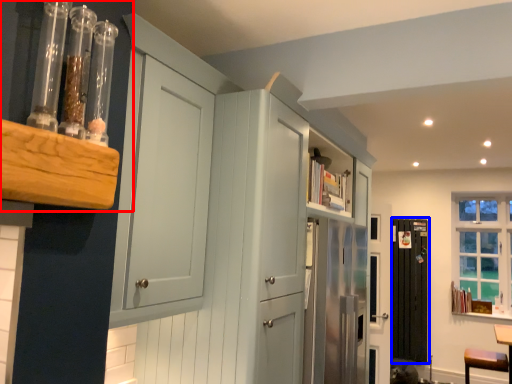
Question: Which object appears farthest to the camera in this image, shelf (highlighted by a red box) or screen door (highlighted by a blue box)?

Choices:
 (A) shelf
 (B) screen door

Answer: (B)